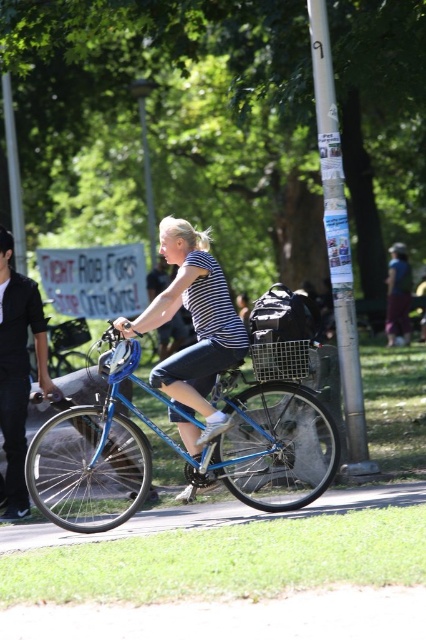
Consider the image. You are a photographer trying to capture the woman riding the blue bicycle. You notice a point at coordinates (195, 330). Where is this point located on the woman?

The point at coordinates (195, 330) is located on the striped fabric shirt at center.

You are a photographer trying to capture the woman riding the blue bicycle in the park. You want to ensure that the dark blue jeans at center are visible in your shot. Based on their position, can you confirm if the jeans are positioned in the lower half of the image?

The dark blue jeans at center is located at point (397,294), which falls within the lower half of the image. Therefore, the jeans will be visible in the lower half of the photograph.

You are a photographer trying to capture a clear shot of the woman riding the blue bicycle. Since you want to focus on her clothing, which part of her outfit will appear larger in your photo, the striped fabric shirt at center or the dark blue jeans at center?

The striped fabric shirt at center will appear larger in the photo because it is closer to the viewer than the dark blue jeans at center.